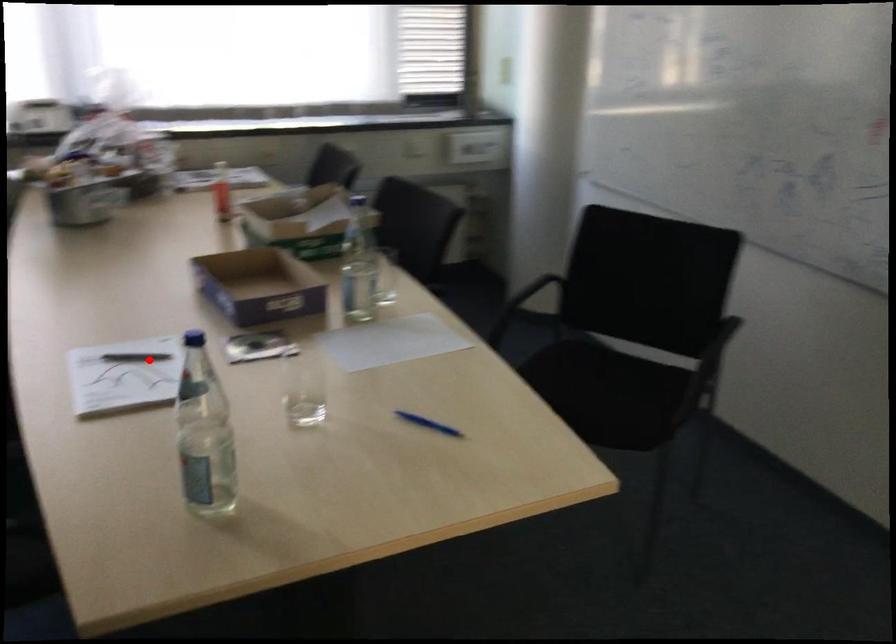
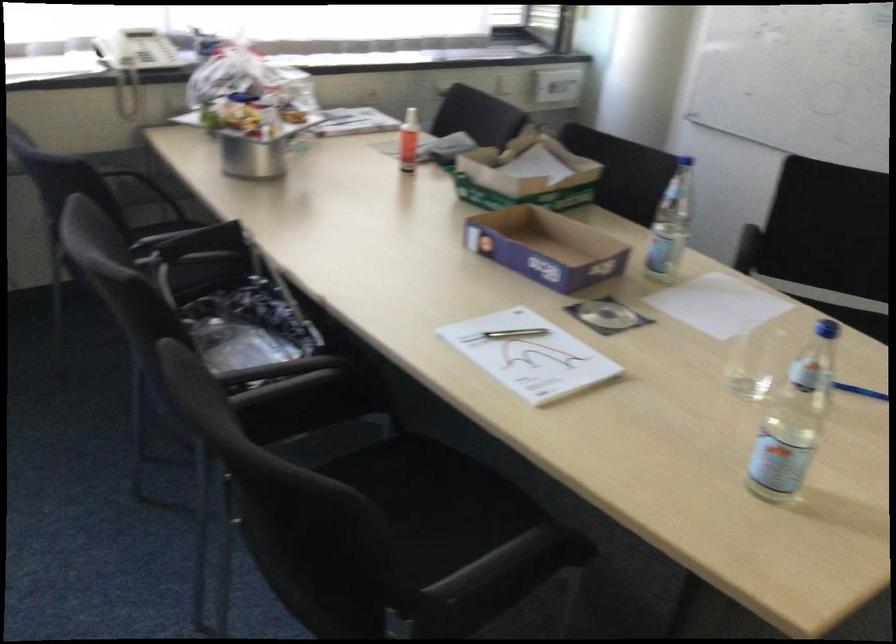
Locate, in the second image, the point that corresponds to the highlighted location in the first image.

(514, 333)